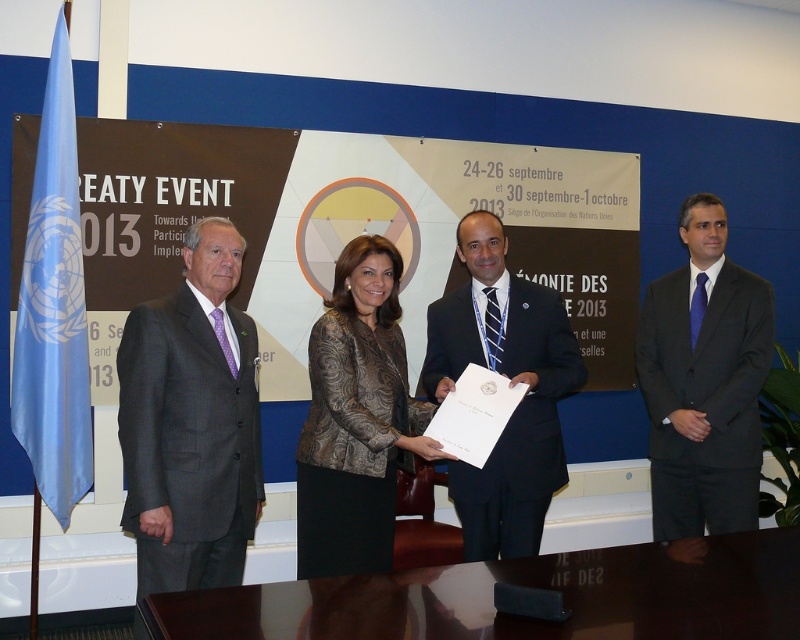
Question: Can you confirm if metallic patterned jacket at center is positioned above blue satin flag at left?

Choices:
 (A) yes
 (B) no

Answer: (B)

Question: Can you confirm if dark blue suit at center is smaller than metallic patterned jacket at center?

Choices:
 (A) yes
 (B) no

Answer: (B)

Question: Which is nearer to the blue satin flag at left?

Choices:
 (A) matte black suit at center
 (B) metallic patterned jacket at center

Answer: (B)

Question: Which point appears closest to the camera in this image?

Choices:
 (A) (152, 513)
 (B) (458, 342)

Answer: (A)

Question: Can you confirm if metallic patterned jacket at center is smaller than matte black suit at center?

Choices:
 (A) yes
 (B) no

Answer: (A)

Question: Which point is farther to the camera?

Choices:
 (A) (145, 628)
 (B) (332, 368)

Answer: (B)